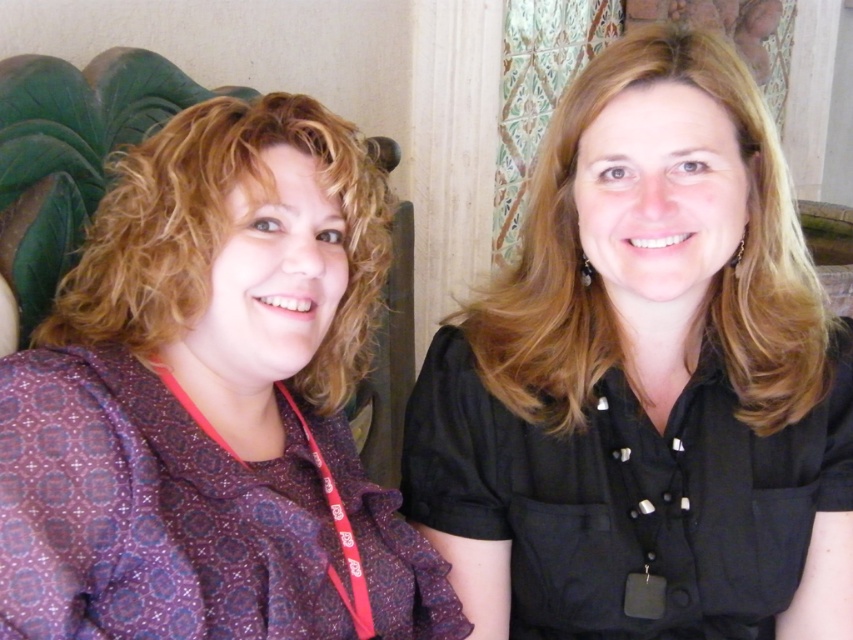
You are an interior designer analyzing the placement of objects in the image. The black matte shirt at upper right is part of the scene. Can you determine if the shirt is positioned closer to the center of the image or near the edge?

The black matte shirt at upper right is located at point (645, 380), which places it closer to the edge of the image rather than the center.

In the scene shown: You are trying to decide which person to take a closeup photo of using a camera with a narrow focus. Since the black matte shirt at upper right and the purple printed blouse at left are both in the frame, which one would you choose to ensure the subject is fully in focus without cropping?

The black matte shirt at upper right has a larger width than the purple printed blouse at left. To ensure the subject is fully in focus without cropping, you should choose the purple printed blouse at left since it is narrower and fits better within the narrow focus area.